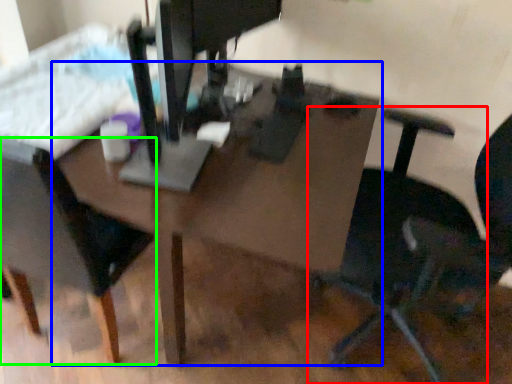
Question: Based on their relative distances, which object is farther from chair (highlighted by a red box)? Choose from table (highlighted by a blue box) and chair (highlighted by a green box).

Choices:
 (A) table
 (B) chair

Answer: (B)